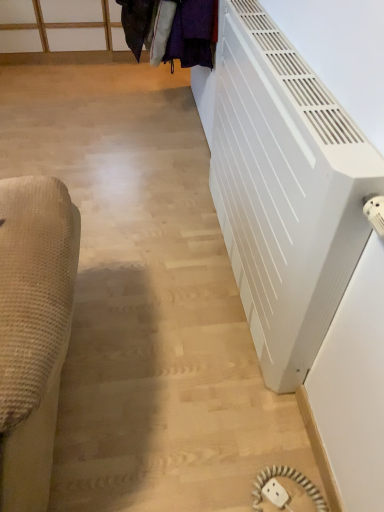
The height and width of the screenshot is (512, 384). What do you see at coordinates (275, 493) in the screenshot?
I see `white plastic outlet at lower right` at bounding box center [275, 493].

Locate an element on the screen. white matte radiator at right is located at coordinates (285, 190).

What do you see at coordinates (285, 190) in the screenshot?
I see `white matte radiator at right` at bounding box center [285, 190].

Locate an element on the screen. This screenshot has width=384, height=512. velvet purple coat at upper center is located at coordinates (192, 33).

Is point (324, 106) more distant than point (277, 506)?

That is False.

Is white matte radiator at right to the left or to the right of white plastic outlet at lower right in the image?

In the image, white matte radiator at right appears on the right side of white plastic outlet at lower right.

Is white matte radiator at right positioned with its back to white plastic outlet at lower right?

No, white matte radiator at right's orientation is not away from white plastic outlet at lower right.

Can you confirm if white matte radiator at right is taller than white plastic outlet at lower right?

Correct, white matte radiator at right is much taller as white plastic outlet at lower right.

From the picture: Which object is positioned more to the left, white plastic outlet at lower right or velvet purple coat at upper center?

Positioned to the left is velvet purple coat at upper center.

Is point (273, 489) less distant than point (195, 56)?

Yes, point (273, 489) is closer to viewer.

In the scene shown: In terms of height, does white plastic outlet at lower right look taller or shorter compared to velvet purple coat at upper center?

white plastic outlet at lower right is shorter than velvet purple coat at upper center.

Is white plastic outlet at lower right positioned behind velvet purple coat at upper center?

No, white plastic outlet at lower right is closer to the viewer.

Which is more to the left, white plastic outlet at lower right or white matte radiator at right?

white plastic outlet at lower right.

How much distance is there between white plastic outlet at lower right and white matte radiator at right?

white plastic outlet at lower right and white matte radiator at right are 33.14 inches apart.

Consider the image. Does white plastic outlet at lower right have a larger size compared to white matte radiator at right?

No.

Considering the positions of objects white plastic outlet at lower right and white matte radiator at right in the image provided, who is behind, white plastic outlet at lower right or white matte radiator at right?

white plastic outlet at lower right is further away from the camera.

Does velvet purple coat at upper center lie in front of white plastic outlet at lower right?

No, velvet purple coat at upper center is behind white plastic outlet at lower right.

Is point (146, 20) closer or farther from the camera than point (274, 501)?

Point (146, 20).

How different are the orientations of velvet purple coat at upper center and white plastic outlet at lower right in degrees?

58.3 degrees separate the facing orientations of velvet purple coat at upper center and white plastic outlet at lower right.

Considering the positions of objects velvet purple coat at upper center and white plastic outlet at lower right in the image provided, who is more to the right, velvet purple coat at upper center or white plastic outlet at lower right?

white plastic outlet at lower right is more to the right.

How many degrees apart are the facing directions of velvet purple coat at upper center and white matte radiator at right?

The facing directions of velvet purple coat at upper center and white matte radiator at right are 0.35 degrees apart.

From a real-world perspective, who is located higher, velvet purple coat at upper center or white matte radiator at right?

velvet purple coat at upper center, from a real-world perspective.

Between point (212, 45) and point (308, 222), which one is positioned in front?

The point (308, 222) is more forward.

Consider the image. Is velvet purple coat at upper center smaller than white matte radiator at right?

Correct, velvet purple coat at upper center occupies less space than white matte radiator at right.

Does point (304, 255) lie behind point (173, 34)?

No.

From the image's perspective, would you say white matte radiator at right is shown under velvet purple coat at upper center?

Yes, from the image's perspective, white matte radiator at right is below velvet purple coat at upper center.

From the picture: Is white matte radiator at right oriented towards velvet purple coat at upper center?

No, white matte radiator at right is not aimed at velvet purple coat at upper center.

Where is `electric outlet that is on the left side of white matte radiator at right`? This screenshot has width=384, height=512. electric outlet that is on the left side of white matte radiator at right is located at coordinates (275, 493).

At what (x,y) coordinates should I click in order to perform the action: click on laundry lying behind the white plastic outlet at lower right. Please return your answer as a coordinate pair (x, y). Looking at the image, I should click on (192, 33).

When comparing their distances from velvet purple coat at upper center, does white matte radiator at right or white plastic outlet at lower right seem closer?

white matte radiator at right is closer to velvet purple coat at upper center.

Consider the image. Considering their positions, is white matte radiator at right positioned further to white plastic outlet at lower right than velvet purple coat at upper center?

velvet purple coat at upper center.

Considering their positions, is velvet purple coat at upper center positioned further to white plastic outlet at lower right than white matte radiator at right?

Among the two, velvet purple coat at upper center is located further to white plastic outlet at lower right.

Looking at the image, which one is located further to velvet purple coat at upper center, white plastic outlet at lower right or white matte radiator at right?

The object further to velvet purple coat at upper center is white plastic outlet at lower right.

Estimate the real-world distances between objects in this image. Which object is closer to white matte radiator at right, white plastic outlet at lower right or velvet purple coat at upper center?

Among the two, velvet purple coat at upper center is located nearer to white matte radiator at right.

Considering their positions, is velvet purple coat at upper center positioned closer to white matte radiator at right than white plastic outlet at lower right?

velvet purple coat at upper center.

Locate an element on the screen. The image size is (384, 512). air conditioning that lies between velvet purple coat at upper center and white plastic outlet at lower right from top to bottom is located at coordinates (285, 190).